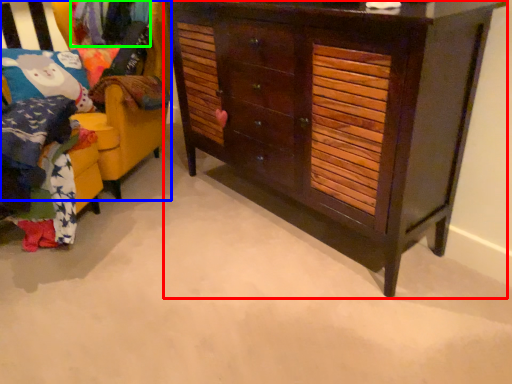
Question: Which is farther away from chest of drawers (highlighted by a red box)? furniture (highlighted by a blue box) or clothing (highlighted by a green box)?

Choices:
 (A) furniture
 (B) clothing

Answer: (B)